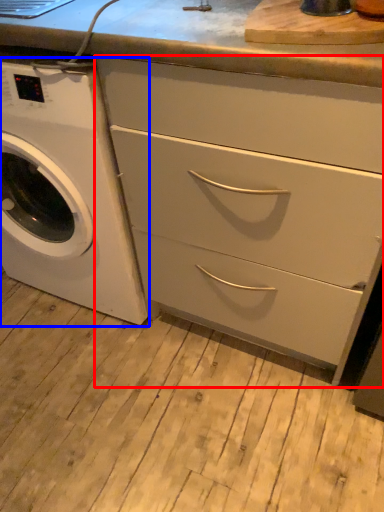
Question: Which point is closer to the camera, chest of drawers (highlighted by a red box) or washing machine (highlighted by a blue box)?

Choices:
 (A) chest of drawers
 (B) washing machine

Answer: (A)